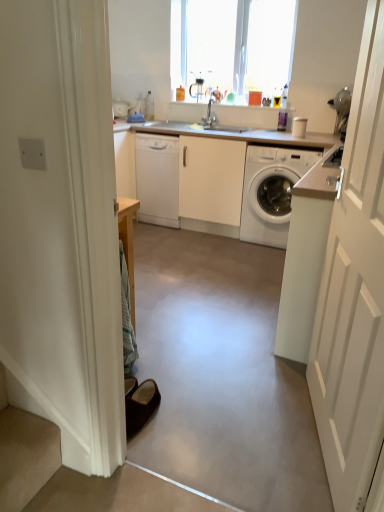
Where is `free space to the left of white wooden door at right`? Image resolution: width=384 pixels, height=512 pixels. free space to the left of white wooden door at right is located at coordinates (242, 424).